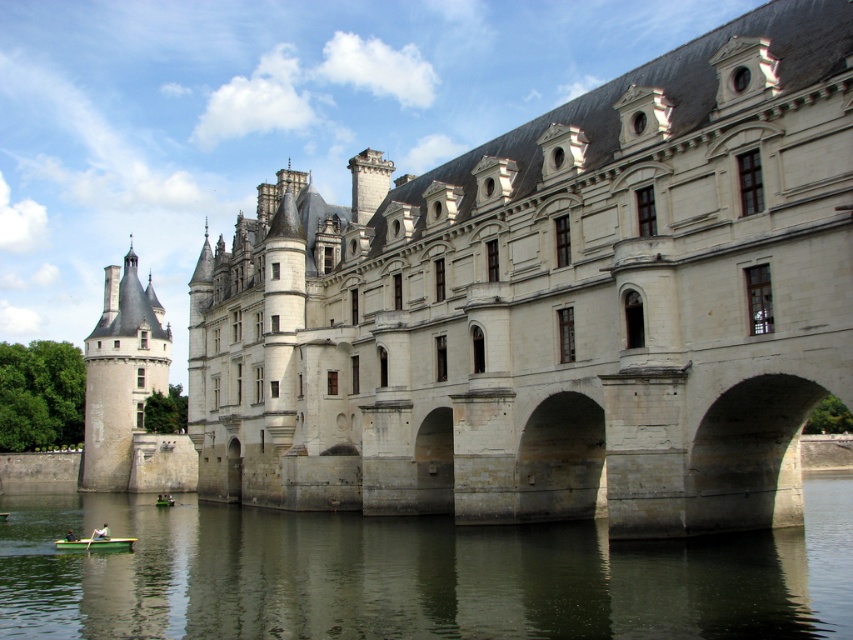
You are standing at the point marked by coordinates point (96, 545) and want to reach the castle. Which direction should you move to get there?

The green wooden boat at lower left is located at point (96, 545). To reach the castle, you should move towards the upper right direction since the castle is situated away from the boat towards that direction.

You are standing on the castle wall and see a point marked at coordinates (100, 532). Which object is this point located on?

The point at coordinates (100, 532) is located on the green fabric boat at lower left.